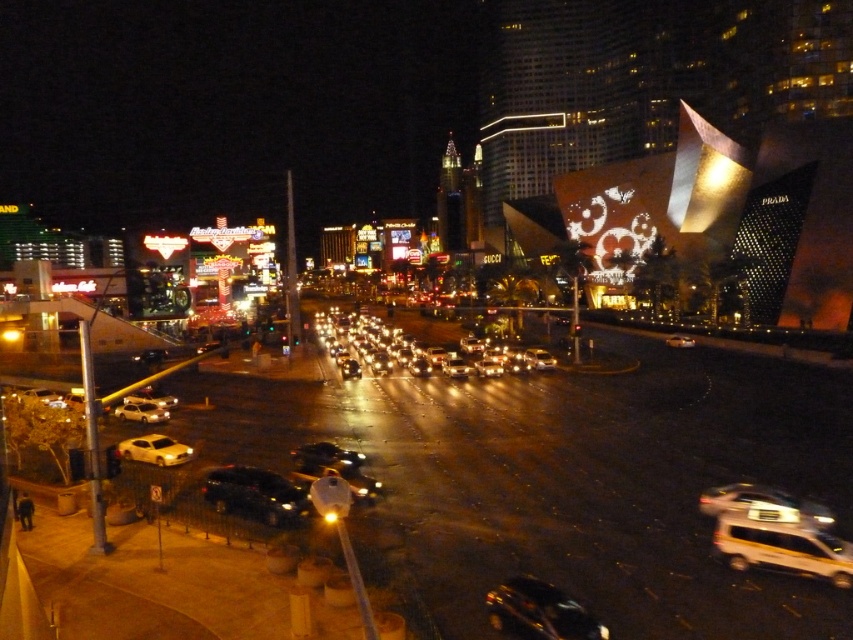
Can you confirm if metallic silver sedan at center is positioned below shiny gold car at center?

Correct, metallic silver sedan at center is located below shiny gold car at center.

In the scene shown: Does metallic silver sedan at center appear over shiny gold car at center?

No, metallic silver sedan at center is not above shiny gold car at center.

This screenshot has height=640, width=853. What are the coordinates of `metallic silver sedan at center` in the screenshot? It's located at (759, 500).

Who is lower down, white glossy car at lower left or shiny gold car at center?

white glossy car at lower left is lower down.

Who is more distant from viewer, (160, 394) or (677, 346)?

Positioned behind is point (677, 346).

The image size is (853, 640). I want to click on white glossy car at lower left, so click(151, 396).

Is yellow matte taxi at lower left below shiny gold car at center?

Correct, yellow matte taxi at lower left is located below shiny gold car at center.

Can you confirm if yellow matte taxi at lower left is positioned above shiny gold car at center?

No.

The image size is (853, 640). Describe the element at coordinates (154, 449) in the screenshot. I see `yellow matte taxi at lower left` at that location.

Locate an element on the screen. This screenshot has width=853, height=640. yellow matte taxi at lower left is located at coordinates (154, 449).